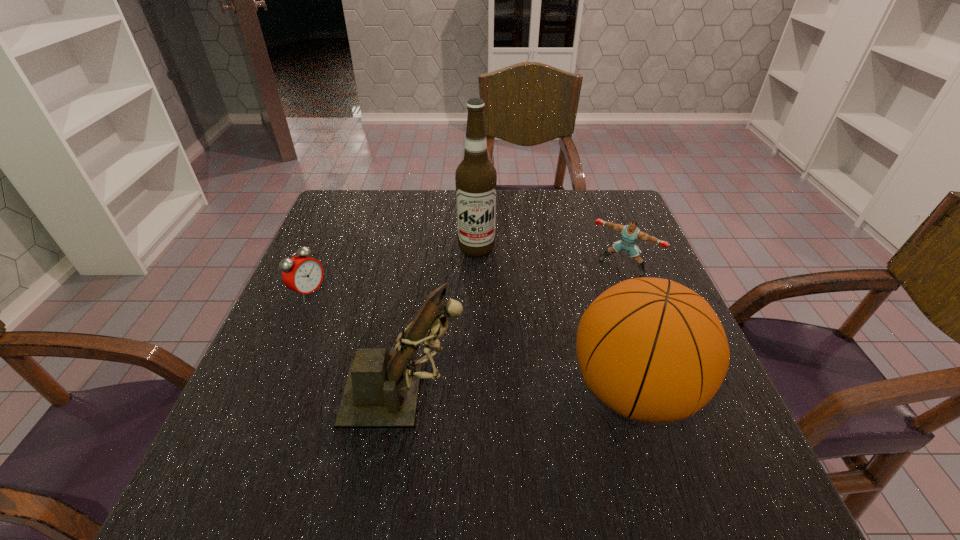
Where is `vacant space at the near right corner`? vacant space at the near right corner is located at coordinates (726, 417).

What are the coordinates of `free spot between the figurine and the basketball` in the screenshot? It's located at (519, 392).

Where is `free spot between the alarm clock and the basketball`? Image resolution: width=960 pixels, height=540 pixels. free spot between the alarm clock and the basketball is located at coordinates (471, 341).

The width and height of the screenshot is (960, 540). What are the coordinates of `unoccupied position between the alcohol and the leftmost object` in the screenshot? It's located at (393, 271).

You are a GUI agent. You are given a task and a screenshot of the screen. Output one action in this format:
    pyautogui.click(x=<x>, y=<y>)
    Task: Click on the free spot between the figurine and the basketball
    
    Given the screenshot: What is the action you would take?
    pyautogui.click(x=519, y=392)

What are the coordinates of `blank region between the figurine and the second shortest object` in the screenshot? It's located at (514, 330).

This screenshot has height=540, width=960. Identify the location of vacant area that lies between the puncher and the figurine. (514, 330).

Choose which object is the second nearest neighbor to the tallest object. Please provide its 2D coordinates. Your answer should be formatted as a tuple, i.e. [(x, y)], where the tuple contains the x and y coordinates of a point satisfying the conditions above.

[(653, 350)]

Locate an element on the screen. the fourth closest object to the fourth tallest object is located at coordinates (302, 274).